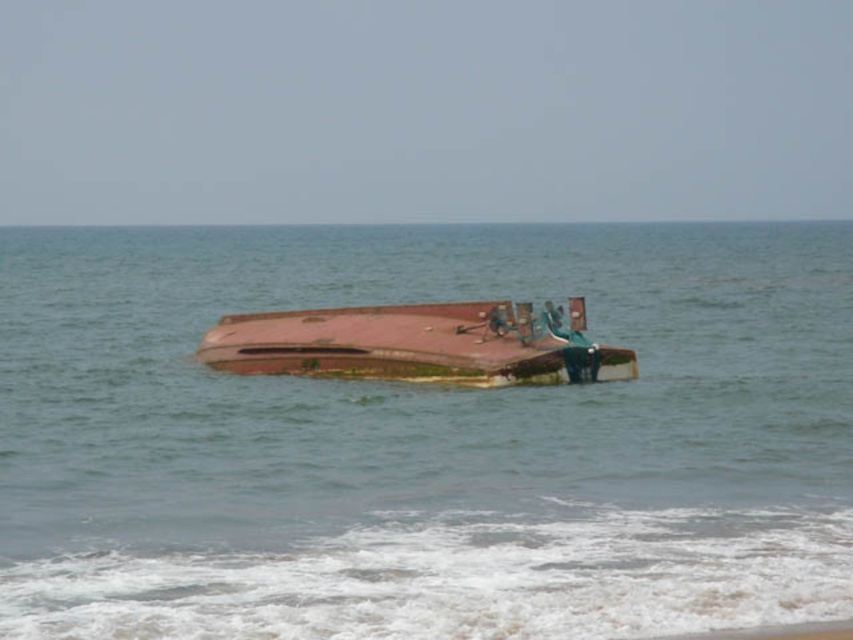
Can you confirm if green algae water at center is positioned to the left of rusty metal boat at center?

Correct, you'll find green algae water at center to the left of rusty metal boat at center.

Image resolution: width=853 pixels, height=640 pixels. What do you see at coordinates (422, 440) in the screenshot? I see `green algae water at center` at bounding box center [422, 440].

This screenshot has height=640, width=853. What are the coordinates of `green algae water at center` in the screenshot? It's located at (422, 440).